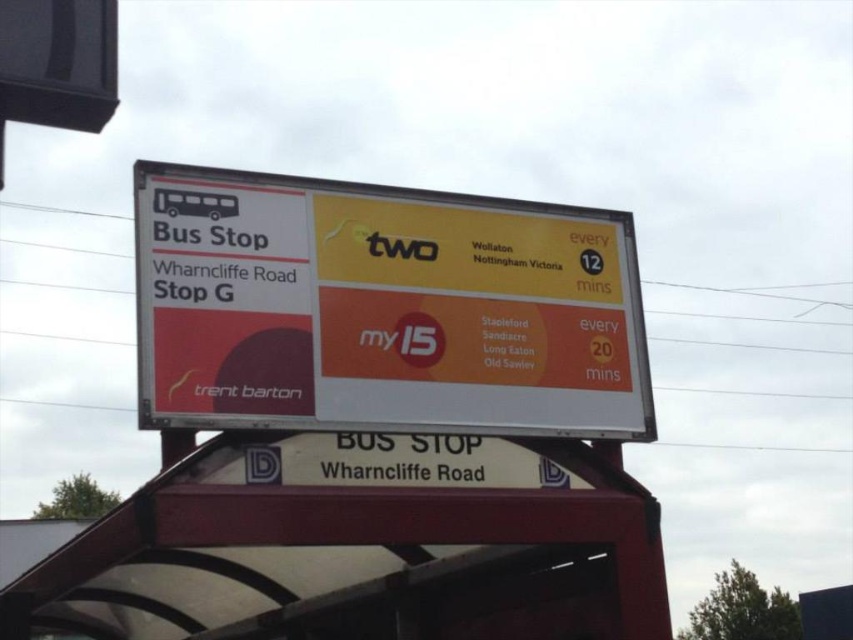
Between point (350, 259) and point (643, 620), which one is positioned in front?

Positioned in front is point (643, 620).

Measure the distance between white plastic signboard at upper center and white plastic bus stop at center.

A distance of 1.18 meters exists between white plastic signboard at upper center and white plastic bus stop at center.

Is point (360, 408) less distant than point (616, 563)?

Yes, it is.

Locate an element on the screen. The height and width of the screenshot is (640, 853). white plastic signboard at upper center is located at coordinates (381, 308).